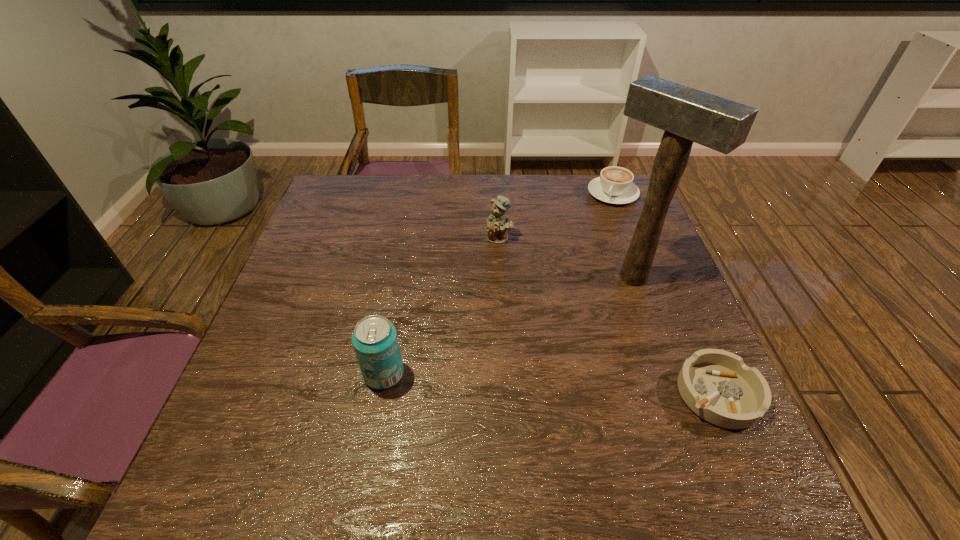
Find the location of a particular element. the leftmost object is located at coordinates (375, 341).

You are a GUI agent. You are given a task and a screenshot of the screen. Output one action in this format:
    pyautogui.click(x=<x>, y=<y>)
    Task: Click on the ashtray
    
    Given the screenshot: What is the action you would take?
    pyautogui.click(x=716, y=385)

At what (x,y) coordinates should I click in order to perform the action: click on the tallest object. Please return your answer as a coordinate pair (x, y). Image resolution: width=960 pixels, height=540 pixels. Looking at the image, I should click on (687, 115).

I want to click on mallet, so click(687, 115).

In order to click on teddy bear in this screenshot , I will do `click(498, 223)`.

Locate an element on the screen. the second farthest object is located at coordinates (498, 223).

Find the location of `the fourth tallest object`. the fourth tallest object is located at coordinates (615, 185).

This screenshot has height=540, width=960. Find the location of `cappuccino`. cappuccino is located at coordinates (615, 185).

Identify the location of free location located 0.090m on the front of the leftmost object. The height and width of the screenshot is (540, 960). (372, 435).

Locate an element on the screen. vacant space located on the back of the shortest object is located at coordinates (682, 311).